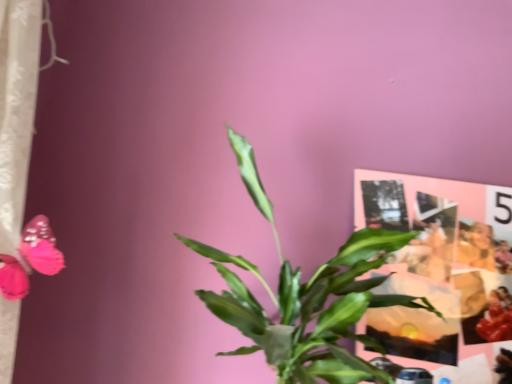
Question: Considering their positions, is matte paper collage at upper right located in front of or behind green leafy plant at center?

Choices:
 (A) front
 (B) behind

Answer: (B)

Question: Based on their sizes in the image, would you say matte paper collage at upper right is bigger or smaller than green leafy plant at center?

Choices:
 (A) big
 (B) small

Answer: (B)

Question: Considering the real-world distances, which object is closest to the green leafy plant at center?

Choices:
 (A) matte paper collage at upper right
 (B) smooth beige jacket at upper right

Answer: (A)

Question: Which object is positioned closest to the green leafy plant at center?

Choices:
 (A) matte paper collage at upper right
 (B) smooth beige jacket at upper right

Answer: (A)